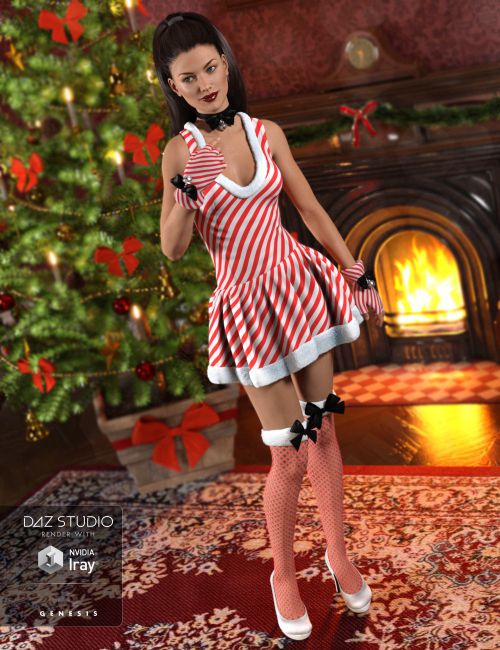
The image size is (500, 650). Find the location of `red bows`. red bows is located at coordinates point(176,426), point(61,19), point(37,374), point(121,254), point(27,170), point(144,140), point(358,114).